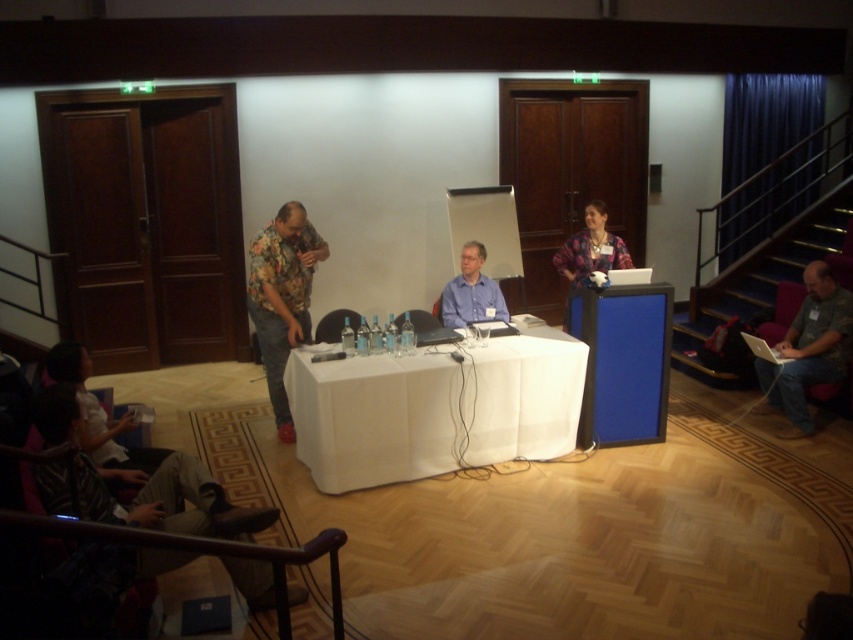
Question: Can you confirm if floral shirt at center is thinner than dark gray fabric jacket at lower left?

Choices:
 (A) yes
 (B) no

Answer: (A)

Question: Considering the real-world distances, which object is closest to the striped fabric shirt at lower left?

Choices:
 (A) dark gray fabric jacket at lower left
 (B) floral shirt at center

Answer: (A)

Question: Which point is closer to the camera?

Choices:
 (A) (88, 436)
 (B) (299, 225)
 (C) (805, 404)
 (D) (625, 266)

Answer: (A)

Question: Which object is farther from the camera taking this photo?

Choices:
 (A) blue shirt at center
 (B) floral shirt at center
 (C) camouflage fabric shirt at lower right

Answer: (A)

Question: Considering the relative positions of white fabric table at center and floral shirt at center in the image provided, where is white fabric table at center located with respect to floral shirt at center?

Choices:
 (A) above
 (B) below

Answer: (B)

Question: From the image, what is the correct spatial relationship of white fabric table at center in relation to blue shirt at center?

Choices:
 (A) right
 (B) left

Answer: (B)